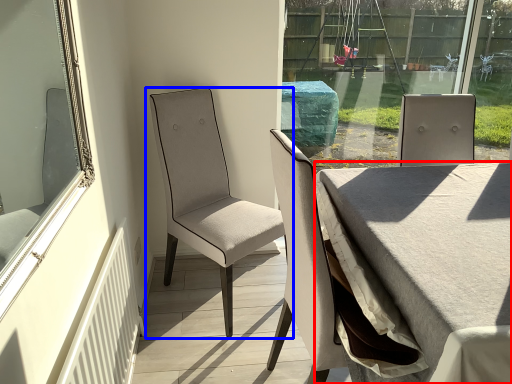
Question: Which object is further to the camera taking this photo, table (highlighted by a red box) or chair (highlighted by a blue box)?

Choices:
 (A) table
 (B) chair

Answer: (B)